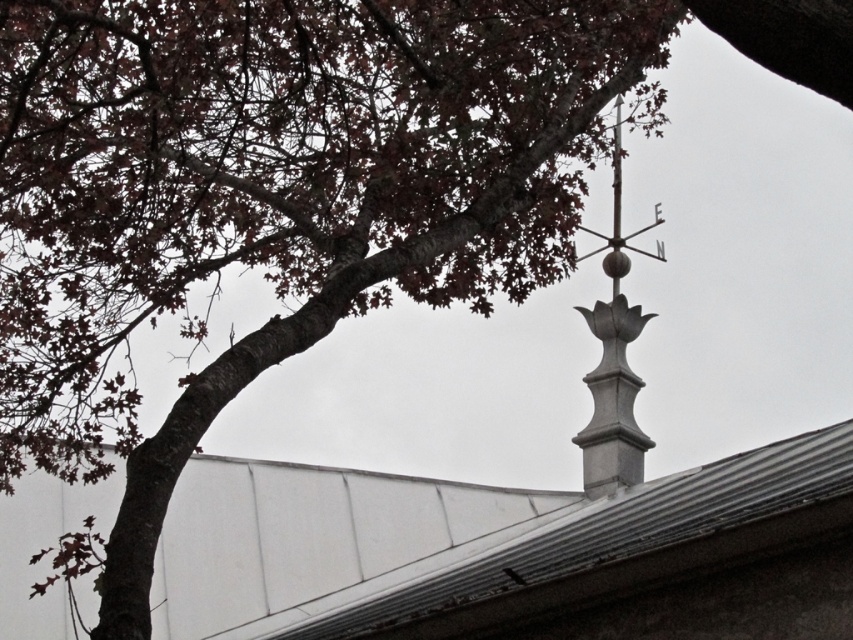
Locate an element on the screen. The height and width of the screenshot is (640, 853). white stone spire at upper center is located at coordinates (614, 358).

Is white stone spire at upper center shorter than white polished metal vane at center?

In fact, white stone spire at upper center may be taller than white polished metal vane at center.

The image size is (853, 640). In order to click on white stone spire at upper center in this screenshot , I will do `click(614, 358)`.